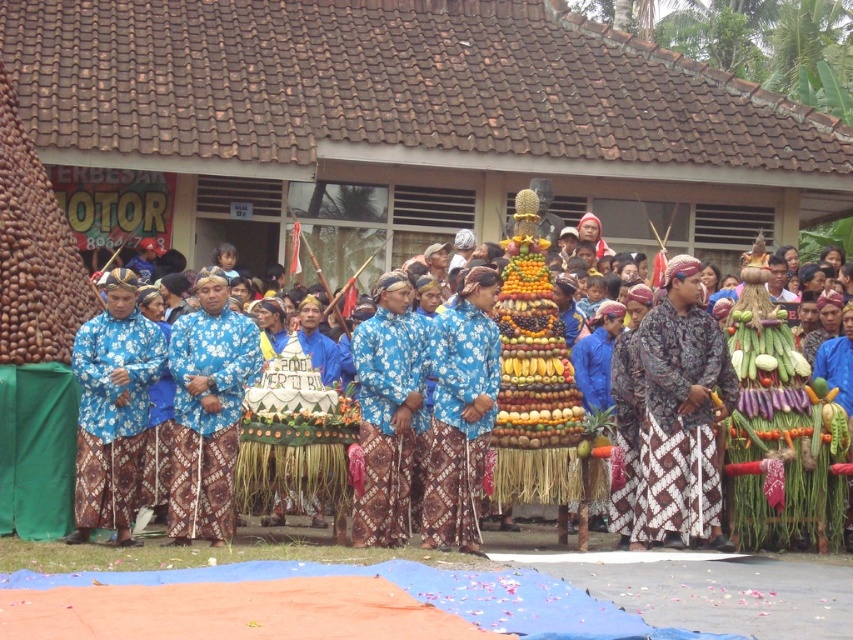
Does blue batik fabric at center have a lesser width compared to blue batik cloth at center?

In fact, blue batik fabric at center might be wider than blue batik cloth at center.

Which of these two, blue batik fabric at center or blue batik cloth at center, stands taller?

Standing taller between the two is blue batik fabric at center.

Is point (531, 252) positioned behind point (102, 408)?

That is True.

Find the location of a particular element. The width and height of the screenshot is (853, 640). blue batik fabric at center is located at coordinates (531, 369).